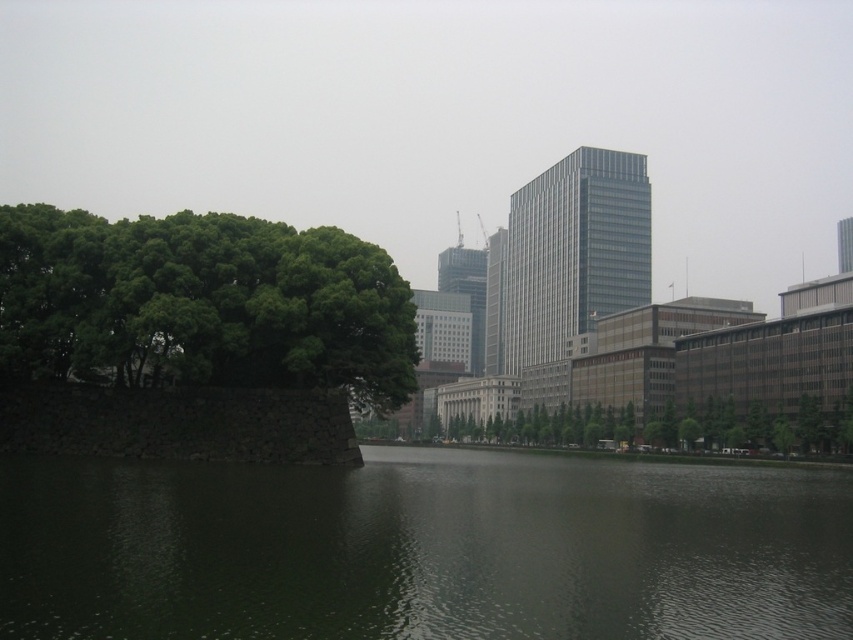
You are an urban planner assessing the space between two green leafy trees in the scene. The trees are labeled as the green leafy tree at left and the green leafy tree at center. Which tree has a narrower width?

The green leafy tree at left has a lesser width compared to the green leafy tree at center, so the green leafy tree at left is narrower.

You are a city planner reviewing this area and need to determine if the green water at center and the green leafy tree at center are positioned in a way that allows for a walking path between them. Can you confirm if there is space between them?

The green water at center is to the left of the green leafy tree at center, so there is space between them for a walking path.